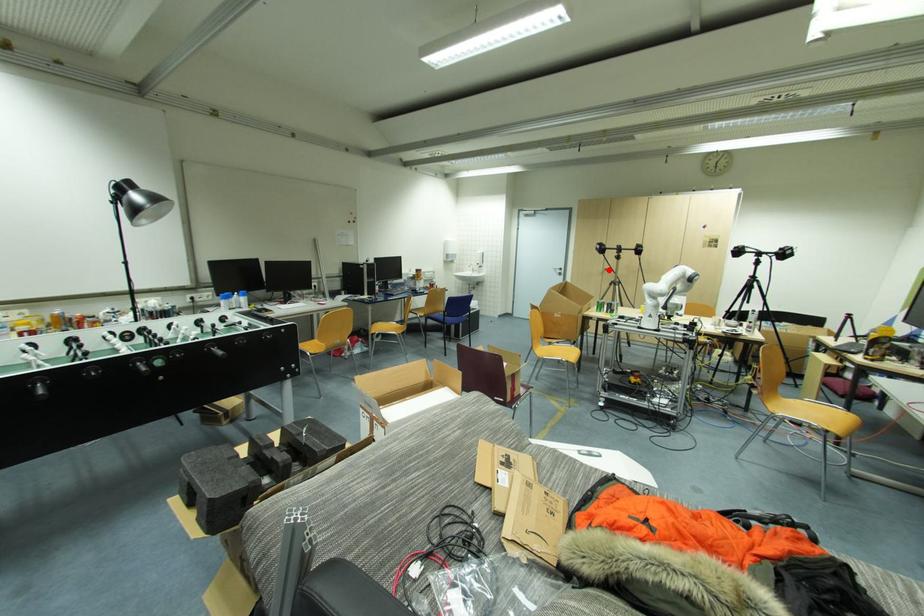
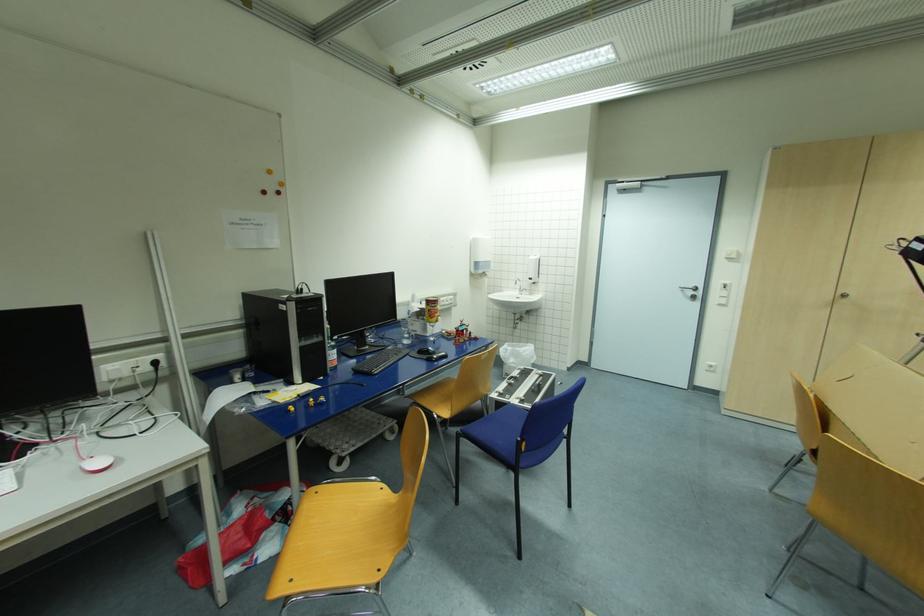
Question: I am providing you with two images of the same scene from different viewpoints. Image1 has a red point marked. In image2, the corresponding 3D location appears at what relative position? Reply with the corresponding letter.

Choices:
 (A) Closer
 (B) Farther

Answer: (B)